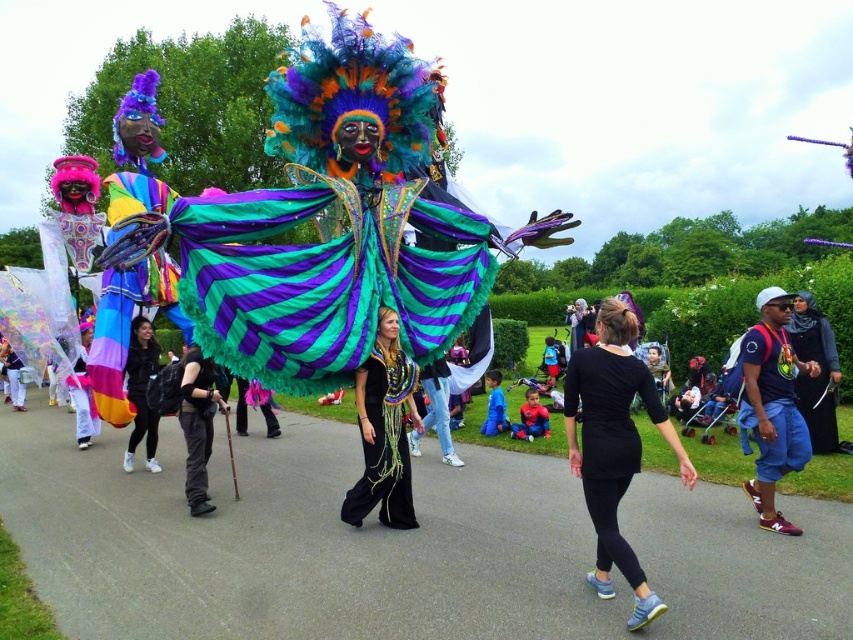
Does point (827, 419) come closer to viewer compared to point (181, 387)?

No, (827, 419) is further to viewer.

Between point (798, 348) and point (190, 490), which one is positioned behind?

The point (798, 348) is behind.

Where is `black satin robe at right`? The image size is (853, 640). black satin robe at right is located at coordinates (816, 376).

Is black matte leggings at lower center positioned in front of black velvet dress at center?

Yes, black matte leggings at lower center is closer to the viewer.

This screenshot has width=853, height=640. What do you see at coordinates (614, 445) in the screenshot?
I see `black matte leggings at lower center` at bounding box center [614, 445].

Which is behind, point (653, 381) or point (366, 451)?

The point (366, 451) is more distant.

Find the location of `black matte leggings at lower center`. black matte leggings at lower center is located at coordinates (614, 445).

In the scene shown: Can you confirm if black velvet dress at center is thinner than black satin robe at right?

Indeed, black velvet dress at center has a lesser width compared to black satin robe at right.

Is black velvet dress at center taller than black satin robe at right?

Yes.

Does point (372, 483) lie in front of point (822, 388)?

Yes, it is in front of point (822, 388).

Identify the location of black velvet dress at center. The image size is (853, 640). (384, 429).